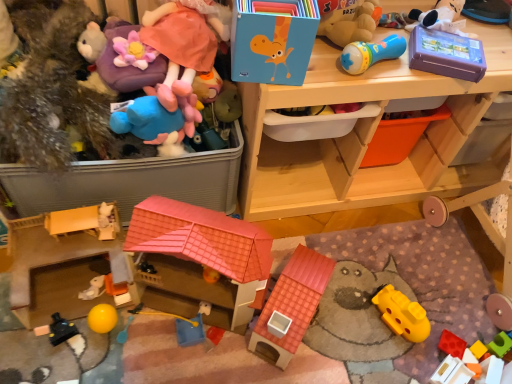
Question: Should I look upward or downward to see purple plush toy at upper left, which is the ninth toy in right-to-left order?

Choices:
 (A) down
 (B) up

Answer: (B)

Question: Is wooden bunk bed at lower right facing away from fuzzy brown teddy bear at left, which appears as the fourteenth toy when viewed from the right?

Choices:
 (A) yes
 (B) no

Answer: (B)

Question: Is wooden bunk bed at lower right to the left of fuzzy brown teddy bear at left, the first toy when ordered from left to right, from the viewer's perspective?

Choices:
 (A) yes
 (B) no

Answer: (B)

Question: Does wooden bunk bed at lower right have a greater width compared to fuzzy brown teddy bear at left, which appears as the fourteenth toy when viewed from the right?

Choices:
 (A) yes
 (B) no

Answer: (B)

Question: Is wooden bunk bed at lower right behind fuzzy brown teddy bear at left, the first toy when ordered from left to right?

Choices:
 (A) no
 (B) yes

Answer: (B)

Question: From a real-world perspective, is wooden bunk bed at lower right positioned over fuzzy brown teddy bear at left, the first toy when ordered from left to right, based on gravity?

Choices:
 (A) yes
 (B) no

Answer: (B)

Question: From the image's perspective, does wooden bunk bed at lower right appear lower than fuzzy brown teddy bear at left, the first toy when ordered from left to right?

Choices:
 (A) yes
 (B) no

Answer: (A)

Question: Is rubberized plastic microphone at upper right, arranged as the fourth toy when viewed from the right, next to fluffy plush at upper left, placed as the 9th toy when sorted from left to right?

Choices:
 (A) no
 (B) yes

Answer: (A)

Question: Is rubberized plastic microphone at upper right, arranged as the fourth toy when viewed from the right, shorter than fluffy plush at upper left, which appears as the 6th toy when viewed from the right?

Choices:
 (A) yes
 (B) no

Answer: (A)

Question: Can you confirm if rubberized plastic microphone at upper right, arranged as the fourth toy when viewed from the right, is taller than fluffy plush at upper left, placed as the 9th toy when sorted from left to right?

Choices:
 (A) no
 (B) yes

Answer: (A)

Question: Is rubberized plastic microphone at upper right, which is the 11th toy from left to right, thinner than fluffy plush at upper left, placed as the 9th toy when sorted from left to right?

Choices:
 (A) no
 (B) yes

Answer: (B)

Question: Does rubberized plastic microphone at upper right, which is the 11th toy from left to right, appear on the right side of fluffy plush at upper left, which appears as the 6th toy when viewed from the right?

Choices:
 (A) no
 (B) yes

Answer: (B)

Question: Are rubberized plastic microphone at upper right, which is the 11th toy from left to right, and fluffy plush at upper left, which appears as the 6th toy when viewed from the right, located far from each other?

Choices:
 (A) yes
 (B) no

Answer: (B)

Question: From a real-world perspective, does rubberized red block at lower right, the thirteenth toy viewed from the left, sit lower than matte plastic toy at center, placed as the tenth toy when sorted from left to right?

Choices:
 (A) yes
 (B) no

Answer: (A)